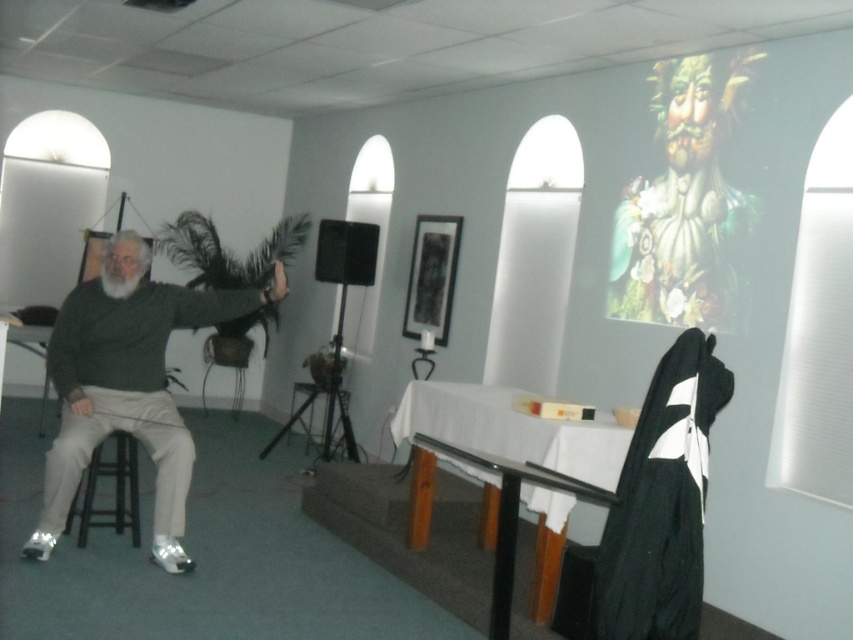
Is black matte robe at right behind black glass table at center?

No, it is in front of black glass table at center.

Is black matte robe at right wider than black glass table at center?

No, black matte robe at right is not wider than black glass table at center.

Which is in front, point (651, 461) or point (489, 529)?

Positioned in front is point (651, 461).

Where is `black matte robe at right`? The height and width of the screenshot is (640, 853). black matte robe at right is located at coordinates (662, 500).

Is black glass table at center in front of wooden stool at left?

Yes, it is in front of wooden stool at left.

Between black glass table at center and wooden stool at left, which one is positioned lower?

black glass table at center

Which is behind, point (546, 422) or point (218, 360)?

Positioned behind is point (218, 360).

Identify the location of black glass table at center. The width and height of the screenshot is (853, 640). (509, 429).

Which is more to the left, matte green sweater at left or black matte robe at right?

Positioned to the left is matte green sweater at left.

Is matte green sweater at left bigger than black matte robe at right?

Yes.

Locate an element on the screen. This screenshot has height=640, width=853. matte green sweater at left is located at coordinates (126, 385).